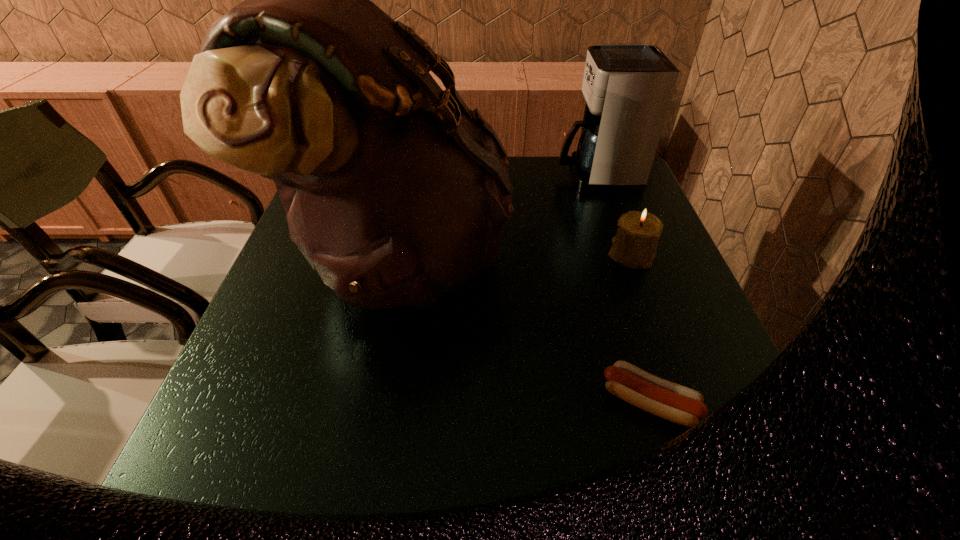
Locate an element on the screen. This screenshot has height=540, width=960. vacant area between the candle_holder and the third shortest object is located at coordinates (613, 215).

Where is `object that stands as the second closest to the second shortest object`? object that stands as the second closest to the second shortest object is located at coordinates (396, 192).

Where is `object that can be found as the second closest to the third shortest object`? This screenshot has height=540, width=960. object that can be found as the second closest to the third shortest object is located at coordinates (634, 246).

The width and height of the screenshot is (960, 540). Identify the location of free spot that satisfies the following two spatial constraints: 1. on the front panel of the coffee maker; 2. on the left side of the candle_holder. (625, 254).

This screenshot has width=960, height=540. What are the coordinates of `free space that satisfies the following two spatial constraints: 1. on the front panel of the candle_holder; 2. on the right side of the coffee maker` in the screenshot? It's located at (625, 254).

Find the location of a particular element. free space that satisfies the following two spatial constraints: 1. at the front of the leftmost object with buckles; 2. on the left side of the nearest object is located at coordinates (374, 402).

At what (x,y) coordinates should I click in order to perform the action: click on vacant space that satisfies the following two spatial constraints: 1. on the front side of the third tallest object; 2. at the front of the tallest object with buckles. Please return your answer as a coordinate pair (x, y). This screenshot has height=540, width=960. Looking at the image, I should click on (632, 258).